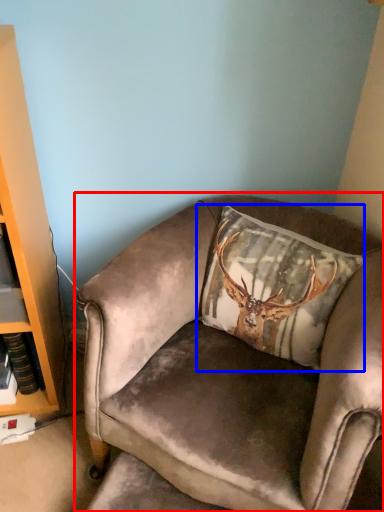
Question: Among these objects, which one is farthest to the camera, chair (highlighted by a red box) or pillow (highlighted by a blue box)?

Choices:
 (A) chair
 (B) pillow

Answer: (B)